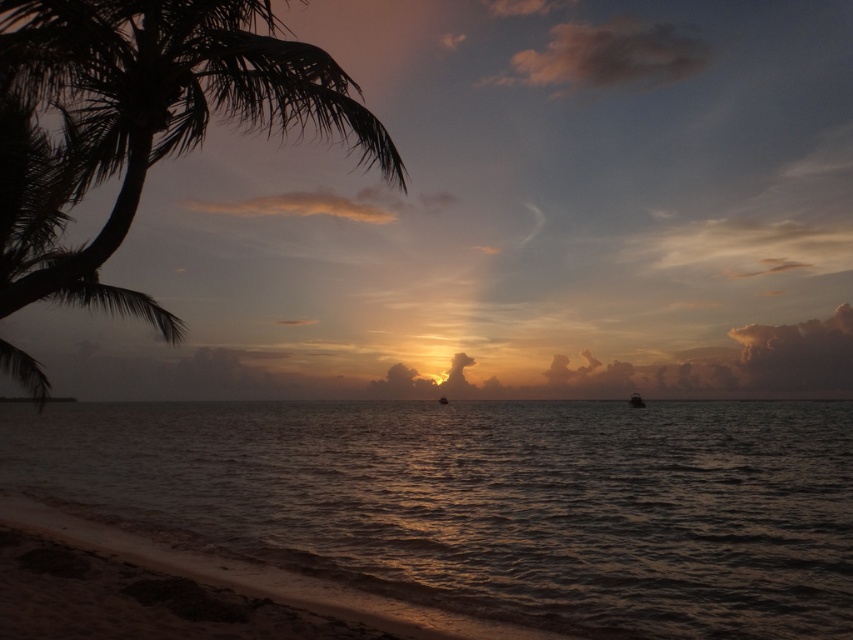
Does silhouette leafy palm at left appear on the left side of metallic silver boat at center?

Correct, you'll find silhouette leafy palm at left to the left of metallic silver boat at center.

Which is more to the right, silhouette leafy palm at left or metallic silver boat at center?

Positioned to the right is metallic silver boat at center.

Identify the location of silhouette leafy palm at left. The height and width of the screenshot is (640, 853). (163, 99).

Between point (312, 550) and point (480, 624), which one is positioned in front?

Point (480, 624)

Identify the location of dull metallic water at center. This screenshot has height=640, width=853. (490, 502).

Which is behind, point (283, 560) or point (120, 564)?

The point (283, 560) is more distant.

Locate an element on the screen. Image resolution: width=853 pixels, height=640 pixels. dull metallic water at center is located at coordinates (490, 502).

Looking at this image, who is positioned more to the right, dull metallic water at center or metallic silver boat at center?

From the viewer's perspective, metallic silver boat at center appears more on the right side.

Can you confirm if dull metallic water at center is positioned below metallic silver boat at center?

No, dull metallic water at center is not below metallic silver boat at center.

This screenshot has width=853, height=640. Find the location of `dull metallic water at center`. dull metallic water at center is located at coordinates [490, 502].